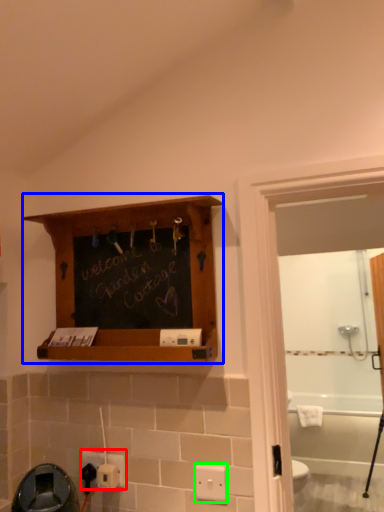
Question: Which object is positioned farthest from electric outlet (highlighted by a red box)? Select from shelf (highlighted by a blue box) and light switch (highlighted by a green box).

Choices:
 (A) shelf
 (B) light switch

Answer: (A)